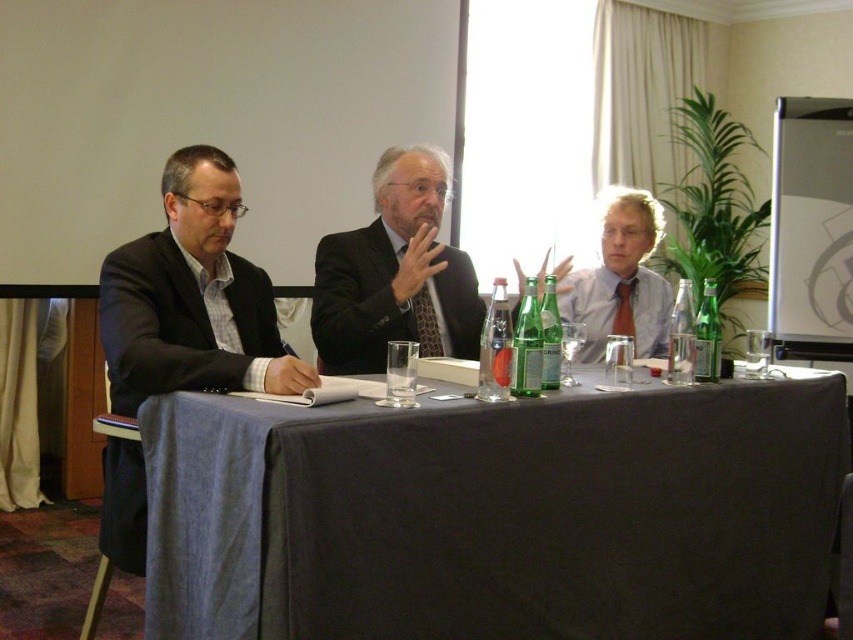
Question: Which object is farther from the camera taking this photo?

Choices:
 (A) black fabric table at center
 (B) matte black shirt at center

Answer: (B)

Question: Can you confirm if black fabric table at center is positioned above matte black shirt at center?

Choices:
 (A) no
 (B) yes

Answer: (A)

Question: In this image, where is black fabric table at center located relative to matte black shirt at center?

Choices:
 (A) right
 (B) left

Answer: (B)

Question: In this image, where is black fabric table at center located relative to matte black shirt at center?

Choices:
 (A) above
 (B) below

Answer: (B)

Question: Which point is closer to the camera?

Choices:
 (A) [764, 429]
 (B) [634, 328]

Answer: (A)